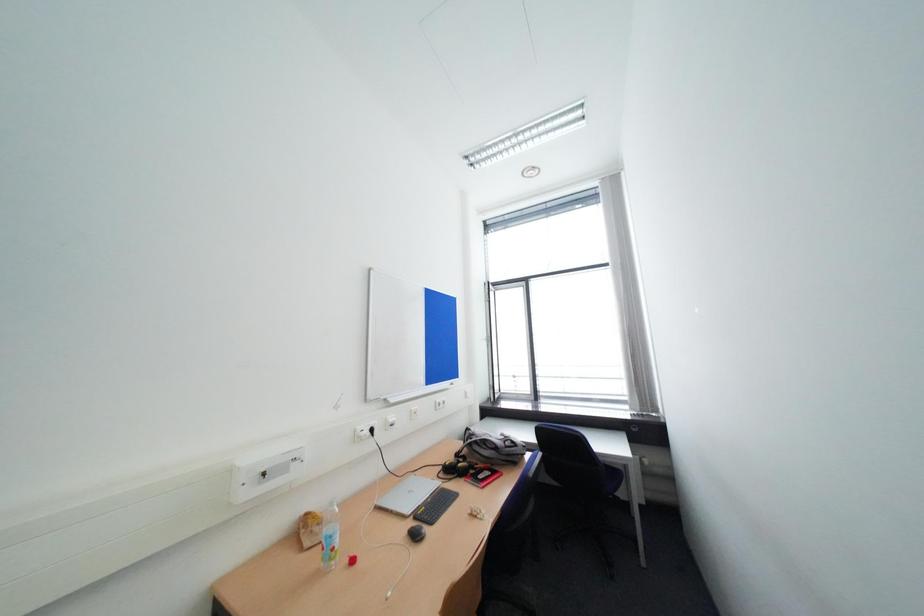
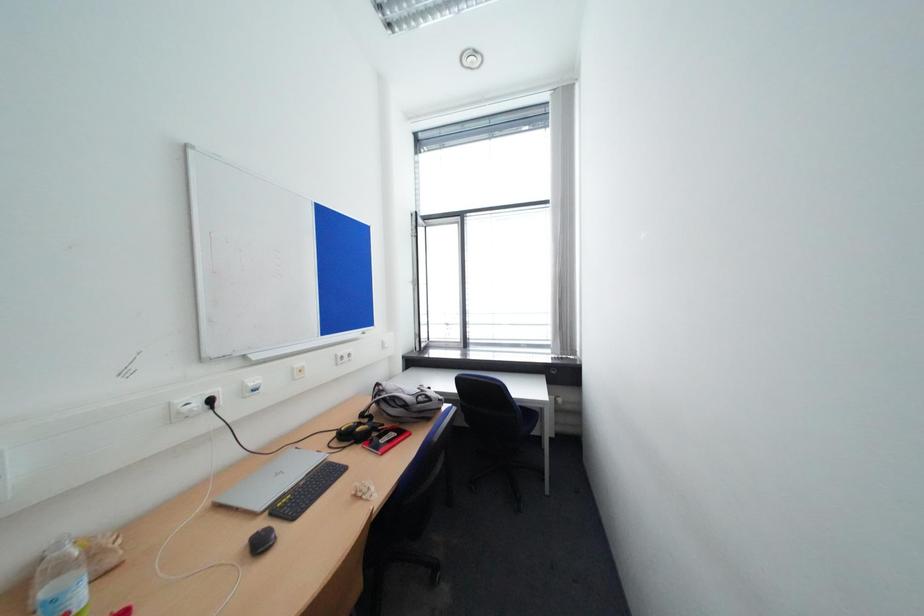
Consider the image. Which direction would the cameraman need to move to produce the second image?

The movement direction of the cameraman is right, forward.